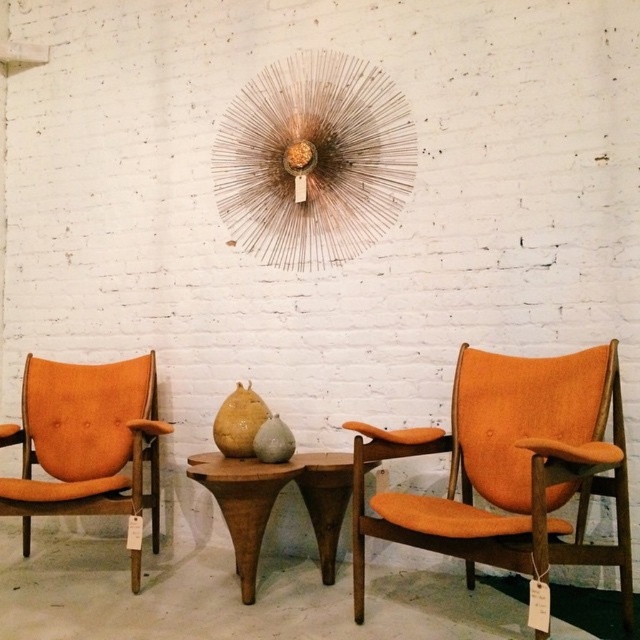
Between orange fabric armchair at left and wooden table at center, which one has less height?

wooden table at center

The height and width of the screenshot is (640, 640). Describe the element at coordinates (86, 442) in the screenshot. I see `orange fabric armchair at left` at that location.

Identify the location of orange fabric armchair at left. (86, 442).

Does orange fabric armchair at right have a smaller size compared to wooden table at center?

No, orange fabric armchair at right is not smaller than wooden table at center.

Which is behind, point (534, 474) or point (234, 460)?

The point (234, 460) is behind.

The width and height of the screenshot is (640, 640). What are the coordinates of `orange fabric armchair at right` in the screenshot? It's located at (508, 468).

Consider the image. Between orange fabric armchair at right and orange fabric armchair at left, which one appears on the right side from the viewer's perspective?

orange fabric armchair at right

Is orange fabric armchair at right shorter than orange fabric armchair at left?

In fact, orange fabric armchair at right may be taller than orange fabric armchair at left.

Identify the location of orange fabric armchair at right. (508, 468).